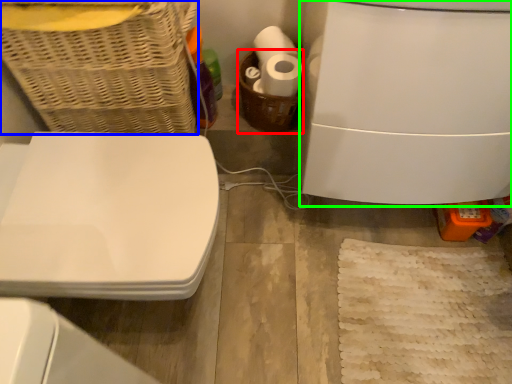
Question: Which object is the farthest from basket (highlighted by a red box)? Choose among these: basket (highlighted by a blue box) or appliance (highlighted by a green box).

Choices:
 (A) basket
 (B) appliance

Answer: (A)